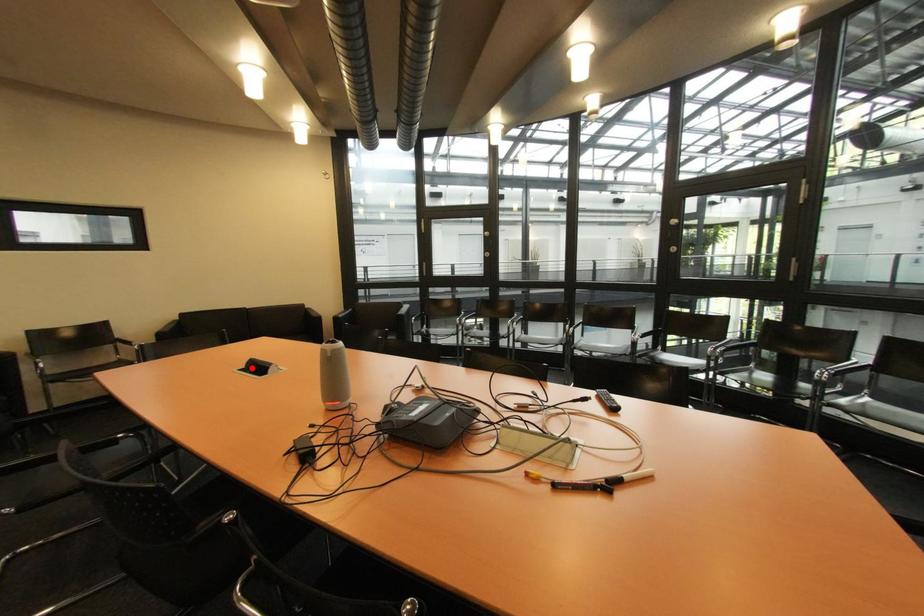
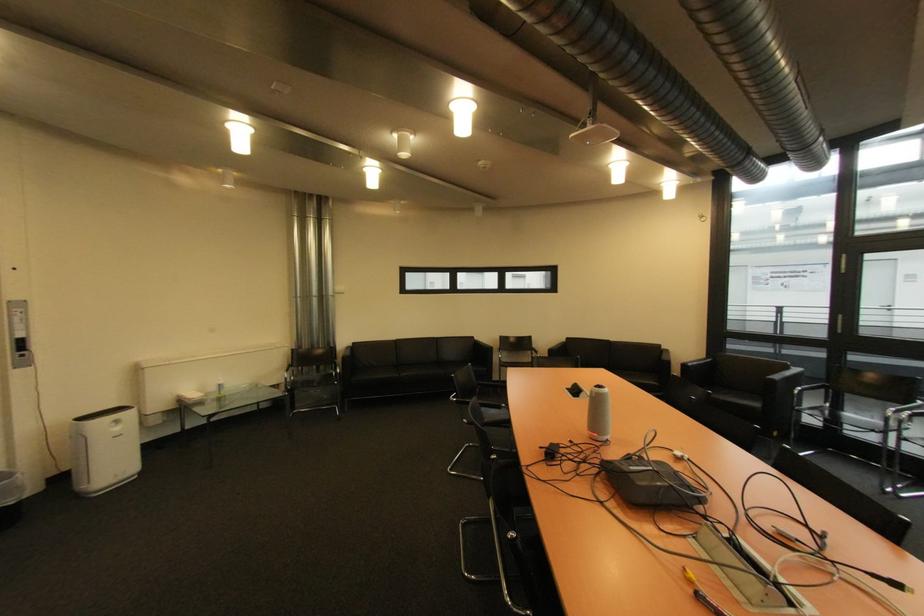
Locate, in the second image, the point that corresponds to the highlighted location in the first image.

(578, 389)